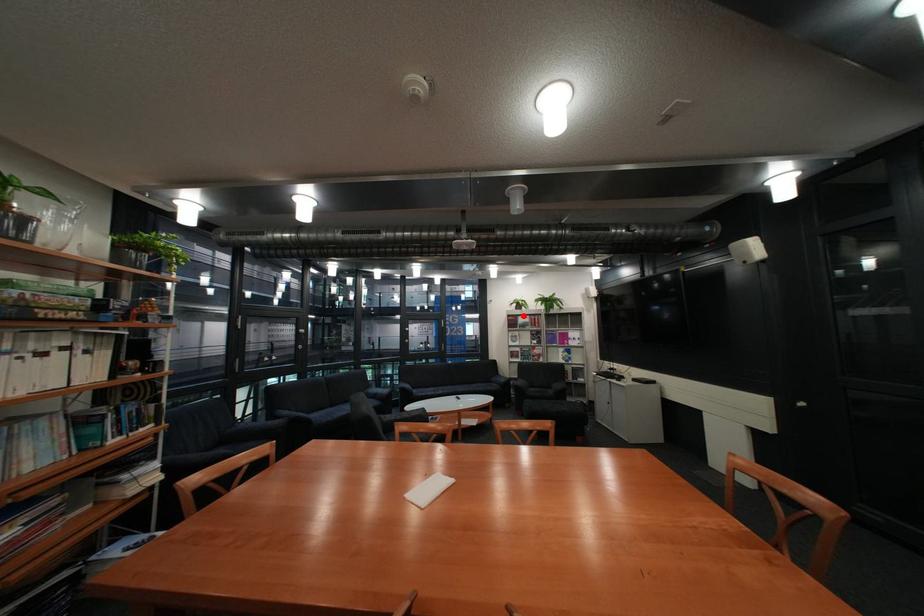
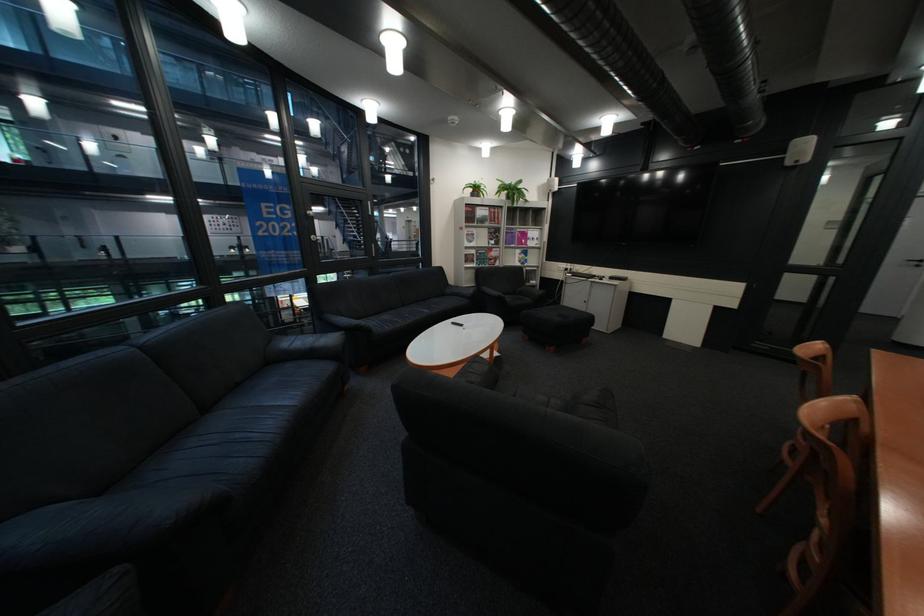
Question: I am providing you with two images of the same scene from different viewpoints. In image1, a red point is highlighted. Considering the same 3D point in image2, which of the following is correct?

Choices:
 (A) It is closer
 (B) It is farther

Answer: (A)